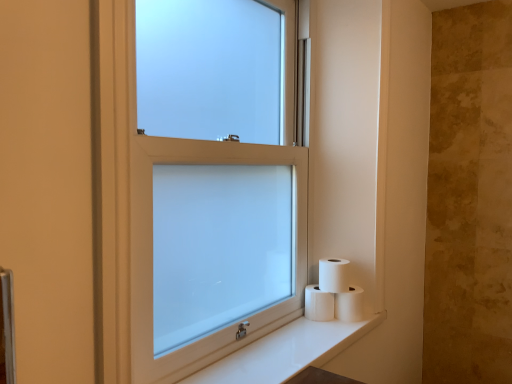
Question: Is white matte toilet paper at lower right, placed as the 3th toilet paper when sorted from left to right, spatially inside white frosted glass window at center, or outside of it?

Choices:
 (A) outside
 (B) inside

Answer: (A)

Question: Considering the positions of white matte toilet paper at lower right, placed as the 3th toilet paper when sorted from left to right, and white frosted glass window at center in the image, is white matte toilet paper at lower right, placed as the 3th toilet paper when sorted from left to right, taller or shorter than white frosted glass window at center?

Choices:
 (A) short
 (B) tall

Answer: (A)

Question: Which object is positioned farthest from the white matte toilet paper at lower right, which appears as the 3th toilet paper when viewed from the right?

Choices:
 (A) white matte toilet paper at lower right, placed as the 3th toilet paper when sorted from left to right
 (B) white glossy counter top at lower right
 (C) white frosted glass window at center
 (D) white matte toilet paper at lower right, which is the second toilet paper in left-to-right order

Answer: (C)

Question: Which object is positioned closest to the white frosted glass window at center?

Choices:
 (A) white matte toilet paper at lower right, placed as the 3th toilet paper when sorted from left to right
 (B) white glossy counter top at lower right
 (C) white matte toilet paper at lower right, which is the second toilet paper in left-to-right order
 (D) white matte toilet paper at lower right, which is the first toilet paper in left-to-right order

Answer: (B)